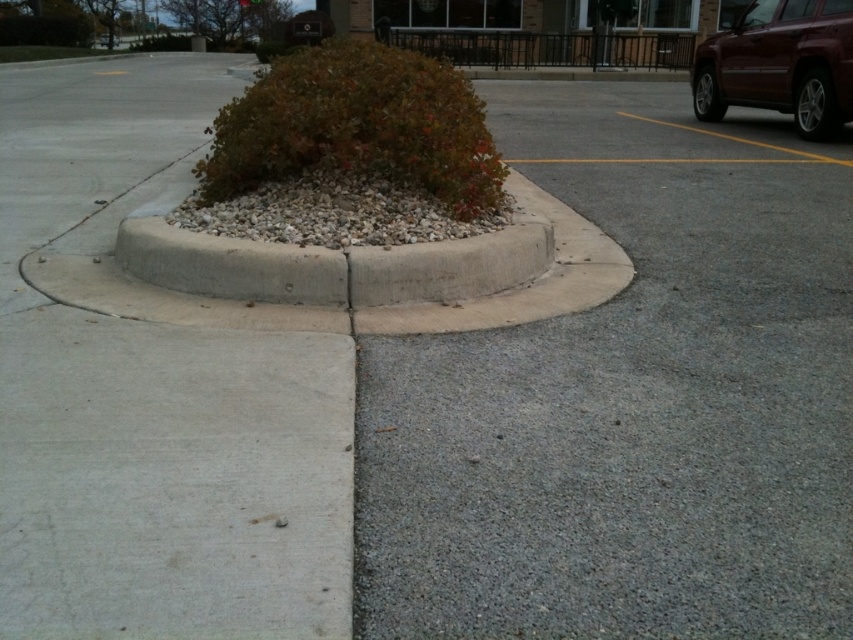
Question: Which is nearer to the gray asphalt at lower right?

Choices:
 (A) shiny maroon suv at upper right
 (B) green leafy bush at center

Answer: (B)

Question: Which of the following is the closest to the observer?

Choices:
 (A) (247, 116)
 (B) (817, 22)

Answer: (A)

Question: Is the position of green leafy bush at center less distant than that of shiny maroon suv at upper right?

Choices:
 (A) no
 (B) yes

Answer: (B)

Question: Which point is closer to the camera?

Choices:
 (A) gray asphalt at lower right
 (B) shiny maroon suv at upper right
 (C) green leafy bush at center

Answer: (A)

Question: Considering the relative positions of green leafy bush at center and shiny maroon suv at upper right in the image provided, where is green leafy bush at center located with respect to shiny maroon suv at upper right?

Choices:
 (A) below
 (B) above

Answer: (A)

Question: Is green leafy bush at center below shiny maroon suv at upper right?

Choices:
 (A) no
 (B) yes

Answer: (B)